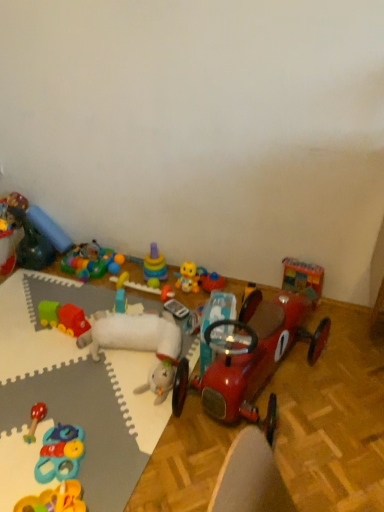
Locate an element on the screen. This screenshot has height=512, width=384. vacant space situated on the left part of rubberized plastic toy at lower left, marked as the sixth toy in a right-to-left arrangement is located at coordinates coord(17,453).